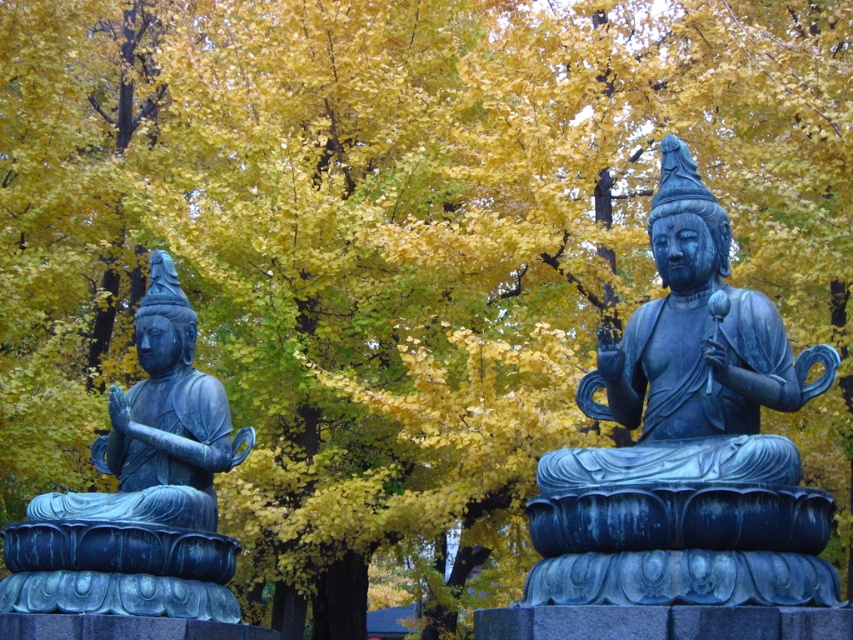
Question: Does bronze statue at right appear on the right side of bronze statue at left?

Choices:
 (A) no
 (B) yes

Answer: (B)

Question: Is bronze statue at right positioned behind bronze statue at left?

Choices:
 (A) no
 (B) yes

Answer: (A)

Question: Where is bronze statue at right located in relation to bronze statue at left in the image?

Choices:
 (A) left
 (B) right

Answer: (B)

Question: Which of the following is the closest to the observer?

Choices:
 (A) (691, 403)
 (B) (82, 529)

Answer: (A)